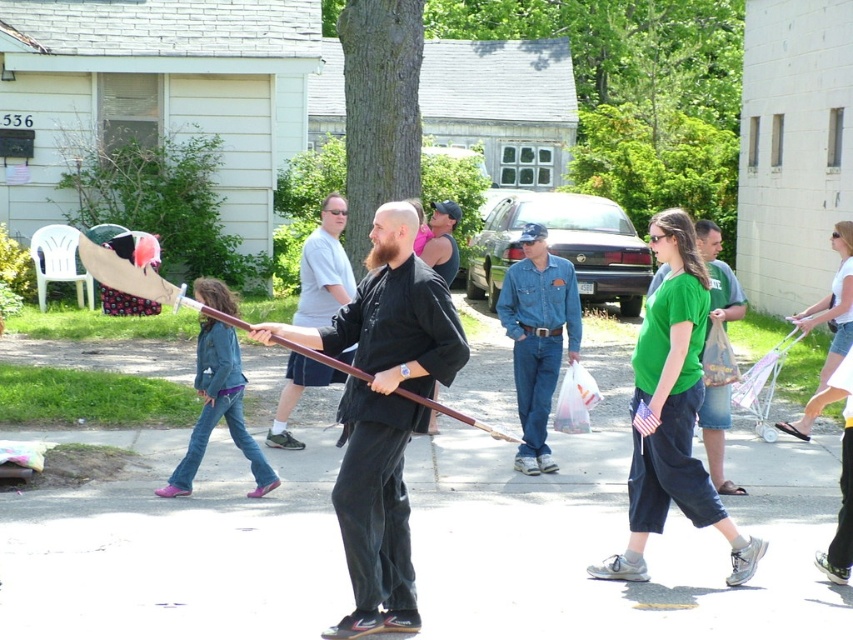
Based on the photo, where is the black matte sword at center located in the image?

The black matte sword at center is located at point 0.645 on the x axis and 0.450 on the y axis.

You are a costume designer trying to create a replica of the man in the image. You have a green matte shirt at center and a black matte sword at center. Which item requires more space to store?

The black matte sword at center requires more space to store because its width is larger than the green matte shirt at center.

You are a photographer taking a picture of the matte black shirt at center and the green matte shirt at center. Which shirt should you focus on first if you want to capture both clearly in the same frame?

The matte black shirt at center is above the green matte shirt at center, so focusing on the matte black shirt at center first would ensure both are in focus as you adjust the camera settings.